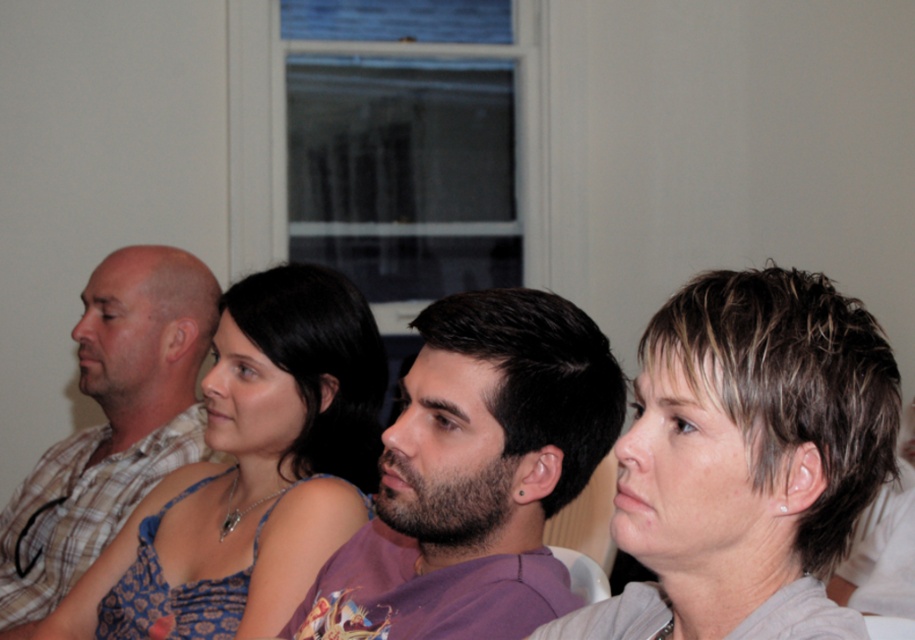
Is short blonde hair at center smaller than matte blue dress at center?

Indeed, short blonde hair at center has a smaller size compared to matte blue dress at center.

Who is shorter, short blonde hair at center or matte blue dress at center?

short blonde hair at center

Measure the distance between point (x=718, y=296) and camera.

Point (x=718, y=296) is 97.39 centimeters away from camera.

Identify the location of short blonde hair at center. The width and height of the screenshot is (915, 640). (747, 460).

Can you confirm if short blonde hair at center is bigger than dark purple t-shirt at center?

Actually, short blonde hair at center might be smaller than dark purple t-shirt at center.

Does point (738, 387) come in front of point (486, 346)?

Yes.

This screenshot has height=640, width=915. I want to click on short blonde hair at center, so click(x=747, y=460).

Can you confirm if dark purple t-shirt at center is bigger than matte blue dress at center?

No, dark purple t-shirt at center is not bigger than matte blue dress at center.

Which of these two, dark purple t-shirt at center or matte blue dress at center, stands shorter?

dark purple t-shirt at center

This screenshot has width=915, height=640. I want to click on dark purple t-shirt at center, so click(475, 476).

Find the location of a particular element. Image resolution: width=915 pixels, height=640 pixels. dark purple t-shirt at center is located at coordinates (475, 476).